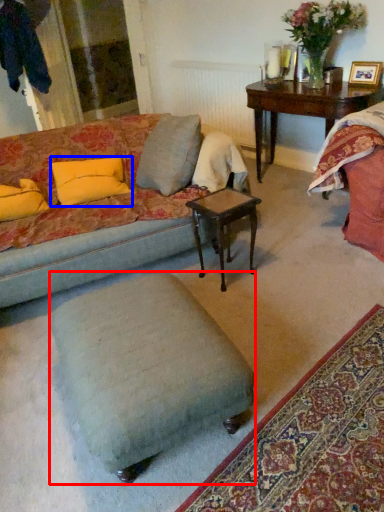
Question: Which object is closer to the camera taking this photo, stool (highlighted by a red box) or pillow (highlighted by a blue box)?

Choices:
 (A) stool
 (B) pillow

Answer: (A)